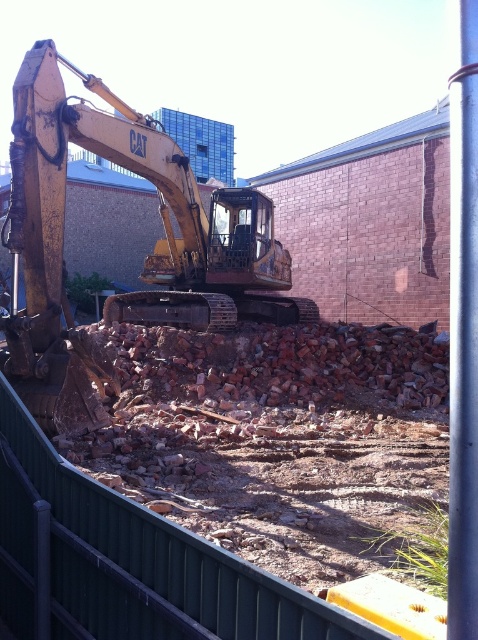
You are a construction worker who needs to move a heavy equipment from the yellow metallic excavator at left to the metallic silver pole at right. Considering their sizes, which one is easier to maneuver around the uneven ground?

The metallic silver pole at right is easier to maneuver around the uneven ground because it is smaller in size compared to the yellow metallic excavator at left.

You are a drone operator flying a drone over a construction site. Your drone is currently hovering above the point at coordinates point (183, 262) and you want to capture a photo of the point at coordinates point (467, 195). To ensure both points are in focus, you need to know which point is closer to the camera. Which point is closer?

Point (467, 195) is closer to the camera because the description states that point (183, 262) is further away than point (467, 195).

You are a construction worker standing at the entrance of the construction site. You need to move from the yellow metallic excavator at left to the metallic silver pole at right. Which direction should you move to get closer to the pole?

Since the yellow metallic excavator at left is closer to you than the metallic silver pole at right, you should move towards the right direction to get closer to the pole.